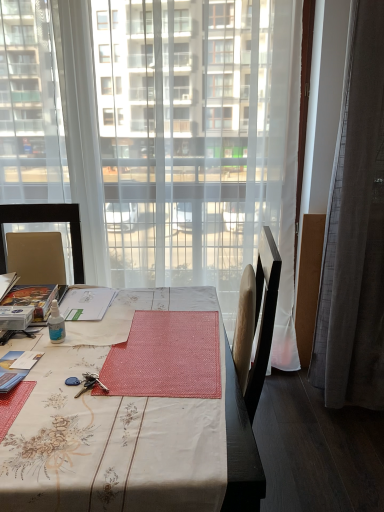
Question: Is floral-patterned fabric desk at center far from gray fabric curtain at right?

Choices:
 (A) yes
 (B) no

Answer: (A)

Question: Is floral-patterned fabric desk at center smaller than gray fabric curtain at right?

Choices:
 (A) yes
 (B) no

Answer: (B)

Question: From a real-world perspective, is floral-patterned fabric desk at center positioned under gray fabric curtain at right based on gravity?

Choices:
 (A) no
 (B) yes

Answer: (B)

Question: From the image's perspective, is floral-patterned fabric desk at center beneath gray fabric curtain at right?

Choices:
 (A) yes
 (B) no

Answer: (A)

Question: Is floral-patterned fabric desk at center wider than gray fabric curtain at right?

Choices:
 (A) no
 (B) yes

Answer: (B)

Question: Which is correct: gray fabric curtain at right is inside transparent curtain at center, or outside of it?

Choices:
 (A) inside
 (B) outside

Answer: (B)

Question: Based on their sizes in the image, would you say gray fabric curtain at right is bigger or smaller than transparent curtain at center?

Choices:
 (A) small
 (B) big

Answer: (B)

Question: In the image, is gray fabric curtain at right on the left side or the right side of transparent curtain at center?

Choices:
 (A) left
 (B) right

Answer: (B)

Question: From their relative heights in the image, would you say gray fabric curtain at right is taller or shorter than transparent curtain at center?

Choices:
 (A) short
 (B) tall

Answer: (B)

Question: Visually, is transparent plastic bottle at table center positioned to the left or to the right of gray fabric curtain at right?

Choices:
 (A) left
 (B) right

Answer: (A)

Question: From the image's perspective, is transparent plastic bottle at table center located above or below gray fabric curtain at right?

Choices:
 (A) below
 (B) above

Answer: (A)

Question: Relative to gray fabric curtain at right, is transparent plastic bottle at table center in front or behind?

Choices:
 (A) front
 (B) behind

Answer: (A)

Question: Is transparent plastic bottle at table center inside or outside of gray fabric curtain at right?

Choices:
 (A) inside
 (B) outside

Answer: (B)

Question: Is transparent plastic bottle at table center inside or outside of transparent curtain at center?

Choices:
 (A) outside
 (B) inside

Answer: (A)

Question: Considering the positions of transparent plastic bottle at table center and transparent curtain at center in the image, is transparent plastic bottle at table center taller or shorter than transparent curtain at center?

Choices:
 (A) short
 (B) tall

Answer: (A)